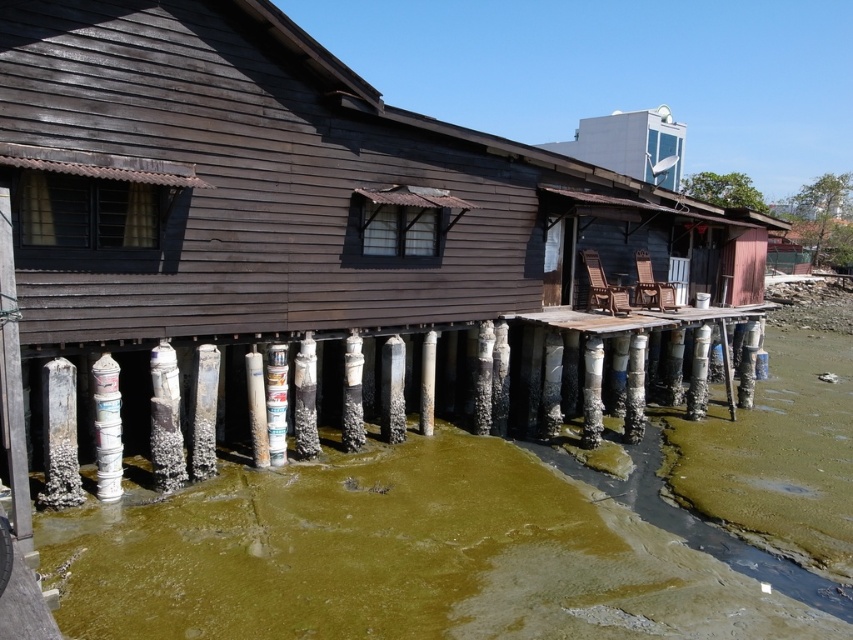
Question: Which point is farther to the camera?

Choices:
 (A) green algae mud at lower center
 (B) white painted wood at lower center
 (C) rusty metal pillar at center

Answer: (C)

Question: Can you confirm if white painted wood pillar at lower left is thinner than white weathered wood post at center?

Choices:
 (A) yes
 (B) no

Answer: (A)

Question: Among these objects, which one is nearest to the camera?

Choices:
 (A) white painted wood at lower center
 (B) rusty metal pillar at center
 (C) white glossy satellite dish at upper center
 (D) white weathered wood post at center

Answer: (A)

Question: Is dirty white wood pillar at lower center smaller than rusty metal pillar at center?

Choices:
 (A) yes
 (B) no

Answer: (A)

Question: Can you confirm if rusty metal pole at lower center is positioned to the left of white painted wood at lower center?

Choices:
 (A) yes
 (B) no

Answer: (A)

Question: Estimate the real-world distances between objects in this image. Which object is farther from the rusty metal pole at lower center?

Choices:
 (A) white weathered wood post at center
 (B) white glossy satellite dish at upper center
 (C) white painted wood at lower center
 (D) green algae mud at lower center

Answer: (B)